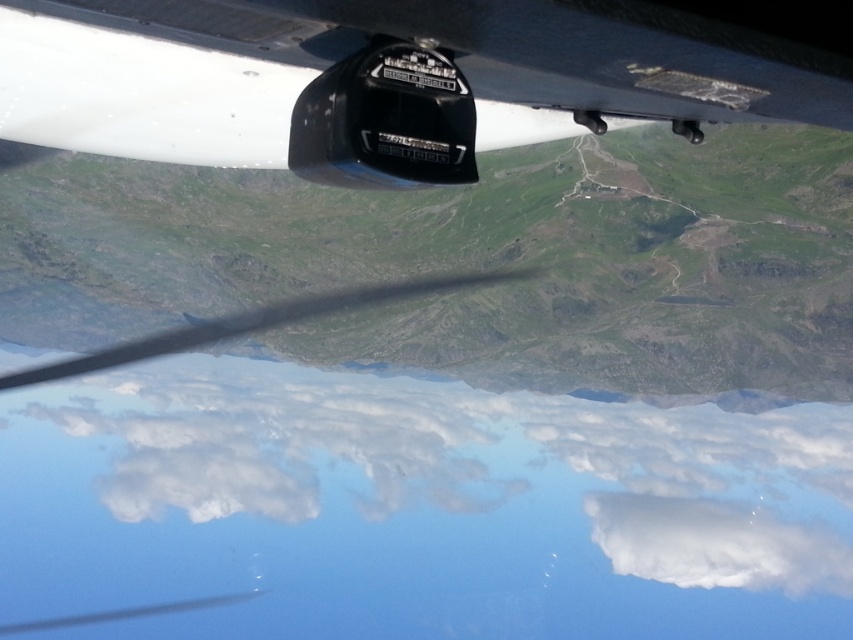
Question: Among these objects, which one is farthest from the camera?

Choices:
 (A) white fluffy cloud at center
 (B) matte black sensor at center

Answer: (A)

Question: Does white fluffy cloud at center have a smaller size compared to matte black sensor at center?

Choices:
 (A) no
 (B) yes

Answer: (A)

Question: Which of the following is the closest to the observer?

Choices:
 (A) matte black sensor at center
 (B) white fluffy cloud at center

Answer: (A)

Question: Is white fluffy cloud at center thinner than matte black sensor at center?

Choices:
 (A) yes
 (B) no

Answer: (B)

Question: Is white fluffy cloud at center to the left of matte black sensor at center from the viewer's perspective?

Choices:
 (A) no
 (B) yes

Answer: (A)